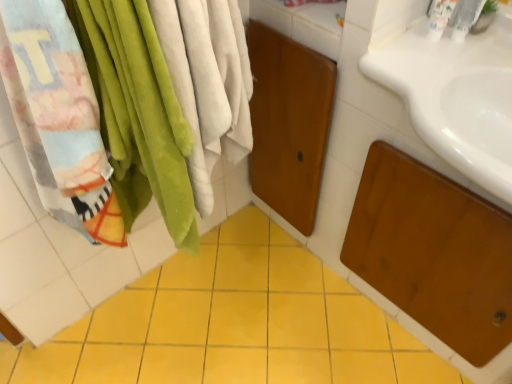
Where is `spots to the right of white plastic faucet at upper right, placed as the 2th toiletry when sorted from left to right`? The width and height of the screenshot is (512, 384). spots to the right of white plastic faucet at upper right, placed as the 2th toiletry when sorted from left to right is located at coordinates (492, 48).